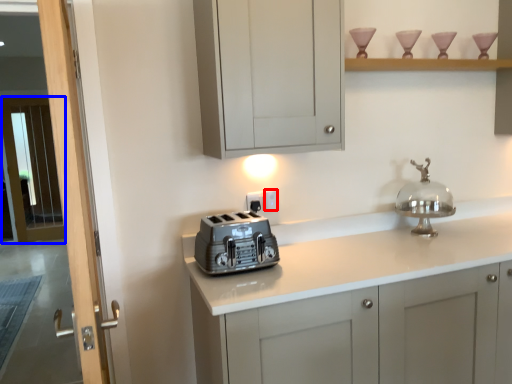
Question: Which point is closer to the camera, electric outlet (highlighted by a red box) or screen door (highlighted by a blue box)?

Choices:
 (A) electric outlet
 (B) screen door

Answer: (A)